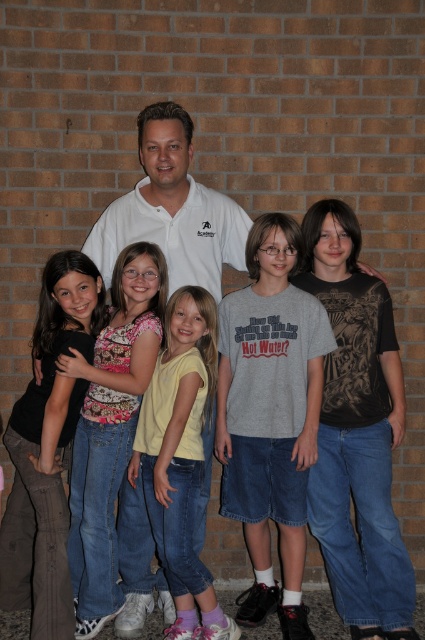
You are a photographer standing 10 feet away from the denim jeans at left. You want to take a photo of the camera. Is the camera within your reach to focus on it without moving closer?

The denim jeans at left and camera are 9.58 feet apart from each other. Since you are 10 feet away from the denim jeans at left, the camera is approximately 9.58 feet away from you. This distance is within typical focusing range for most cameras, so you can focus on the camera without needing to move closer.

You are a photographer standing in front of the group. You need to take a photo that includes both the denim jeans at left and the yellow cotton shirt at center. Based on their positions, which object should be placed on the left side of the photo frame?

The denim jeans at left should be placed on the left side of the photo frame since it is positioned to the left of the yellow cotton shirt at center.